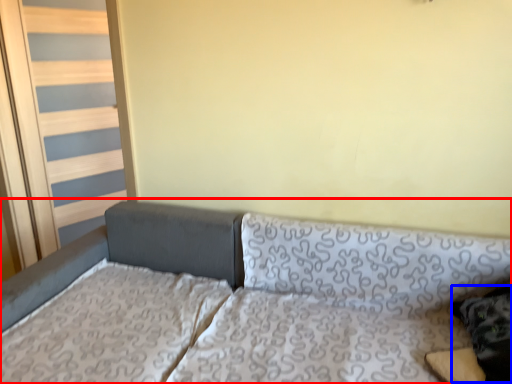
Question: Which object is closer to the camera taking this photo, studio couch (highlighted by a red box) or pillow (highlighted by a blue box)?

Choices:
 (A) studio couch
 (B) pillow

Answer: (A)